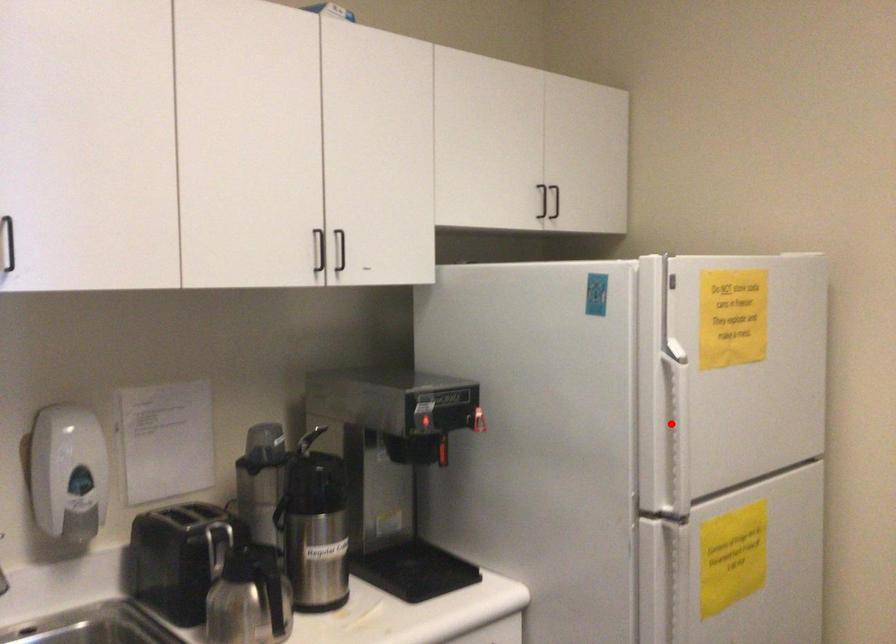
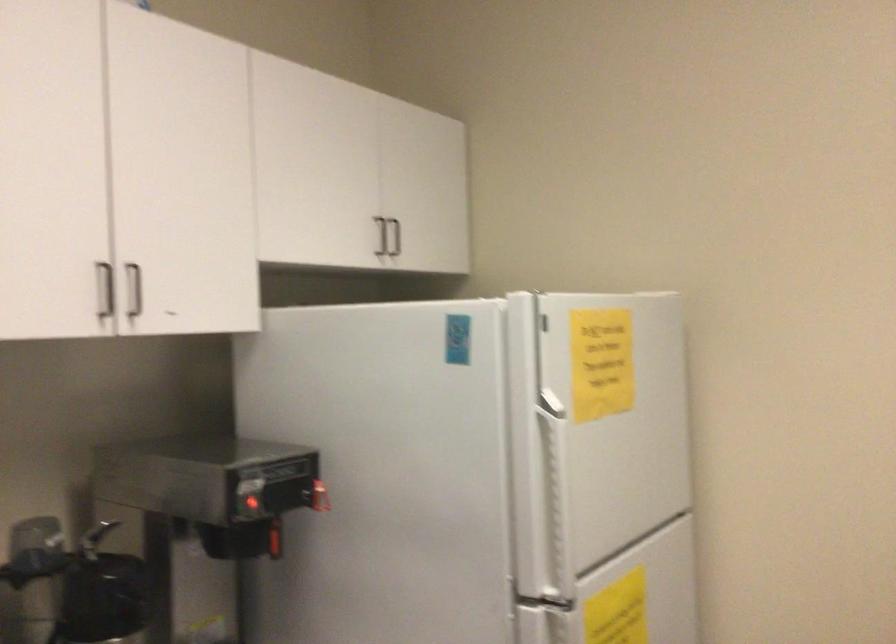
Question: I am providing you with two images of the same scene from different viewpoints. Given a red point in image1, look at the same physical point in image2. Is it:

Choices:
 (A) Closer to the viewpoint
 (B) Farther from the viewpoint

Answer: (A)